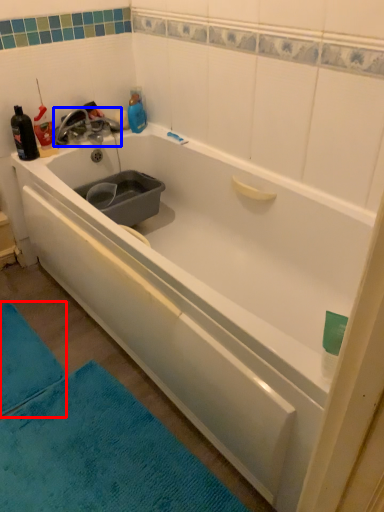
Question: Which object is closer to the camera taking this photo, bath mat (highlighted by a red box) or tap (highlighted by a blue box)?

Choices:
 (A) bath mat
 (B) tap

Answer: (A)